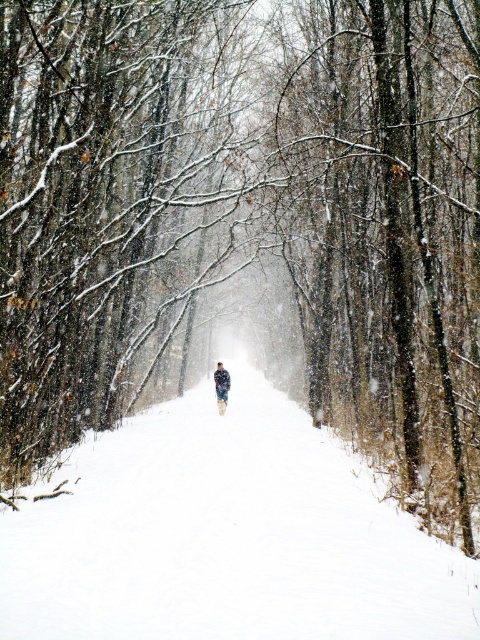
You are a hiker trying to stay dry in the snow. You see the white fluffy snow at center and the fluffy white snowsuit at center. Which one is on top of the other?

The white fluffy snow at center is positioned under the fluffy white snowsuit at center, so the snowsuit is on top of the snow.

You are a hiker who wants to take a photo of the fluffy white snowsuit at center and the white fluffy snow at center in the winter forest scene. Your camera can focus on objects within 10 meters. Will both objects be in focus?

The white fluffy snow at center is 8.43 meters from the fluffy white snowsuit at center. Since the camera can focus within 10 meters, both objects are within the 10 meter range and will be in focus.

You are standing at the entrance of a snow path and want to walk towards the center of the scene. Which direction should you walk to reach the white fluffy snow at center?

The white fluffy snow at center is located at the central area of the scene, so you should walk straight ahead towards the center to reach it.